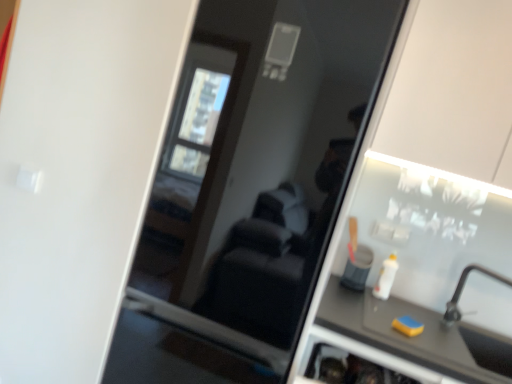
Question: Relative to white plastic bottle at right, is transparent glass screen door at center in front or behind?

Choices:
 (A) behind
 (B) front

Answer: (B)

Question: Is transparent glass screen door at center spatially inside white plastic bottle at right, or outside of it?

Choices:
 (A) inside
 (B) outside

Answer: (B)

Question: Considering the real-world distances, which object is closest to the white plastic bottle at right?

Choices:
 (A) yellow sponge at lower right
 (B) matte black counter top at lower right
 (C) transparent glass screen door at center
 (D) silver metallic faucet at lower right

Answer: (B)

Question: Based on their relative distances, which object is farther from the yellow sponge at lower right?

Choices:
 (A) white plastic bottle at right
 (B) matte black counter top at lower right
 (C) silver metallic faucet at lower right
 (D) transparent glass screen door at center

Answer: (D)